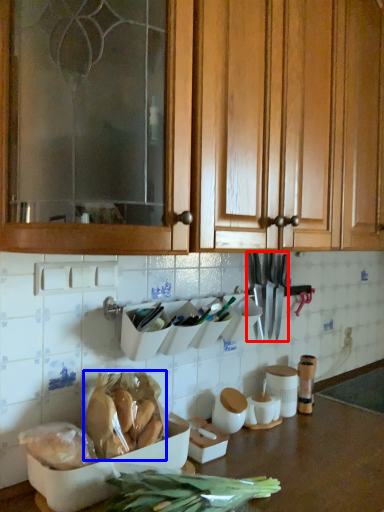
Question: Which object is closer to the camera taking this photo, cutlery (highlighted by a red box) or food (highlighted by a blue box)?

Choices:
 (A) cutlery
 (B) food

Answer: (B)